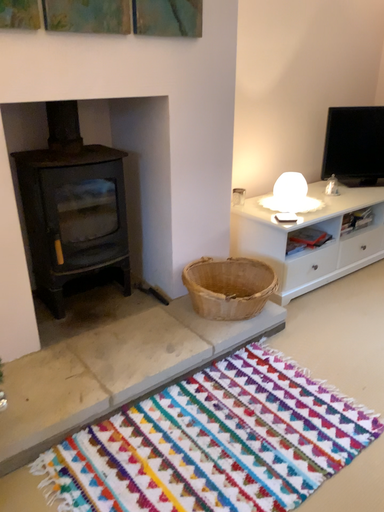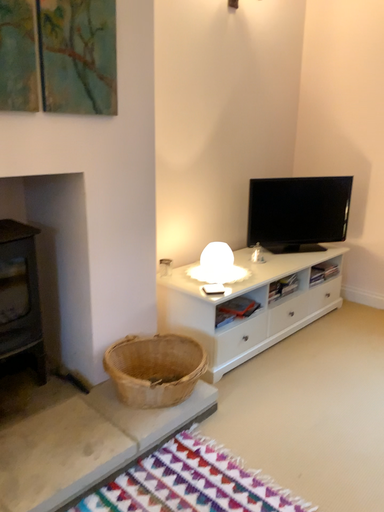
Question: Which way did the camera rotate in the video?

Choices:
 (A) rotated left
 (B) rotated right

Answer: (B)